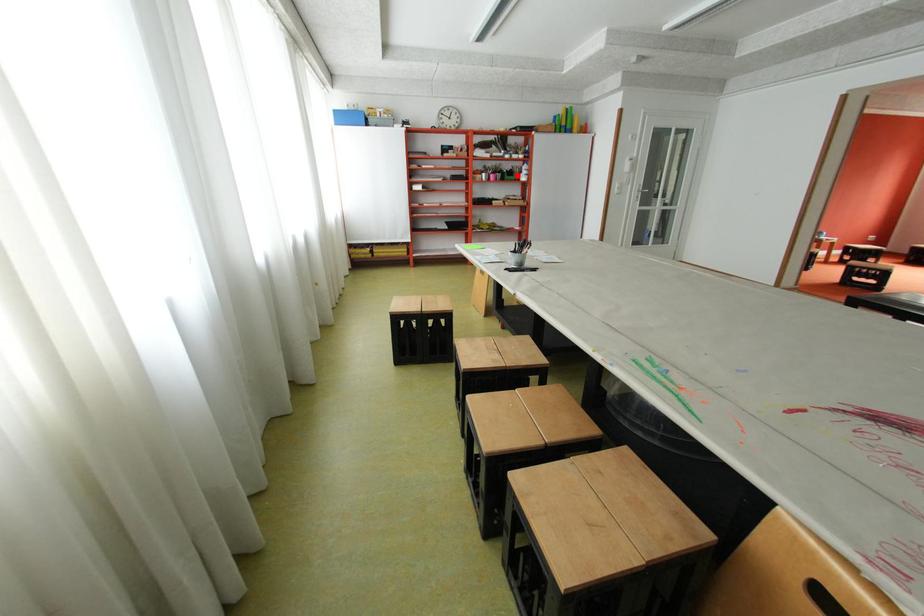
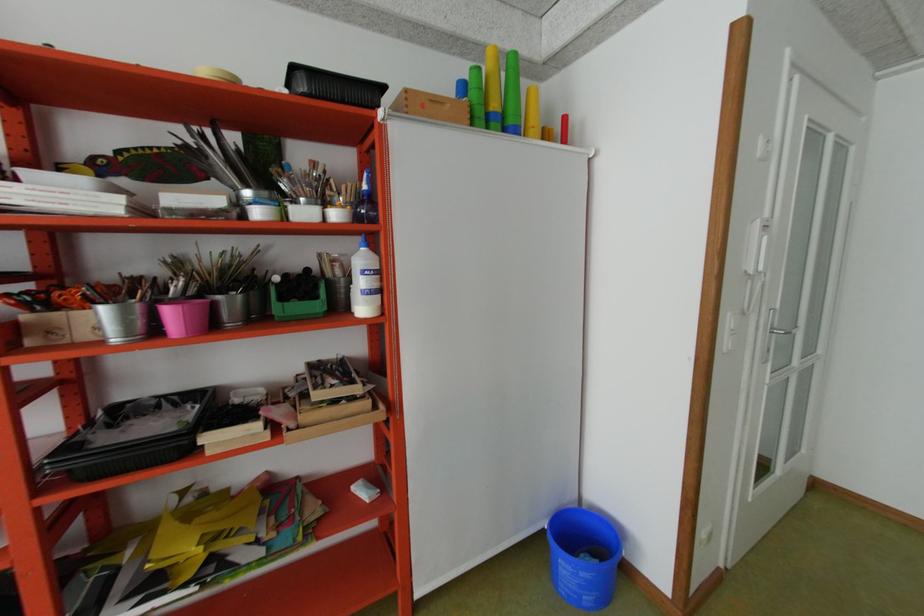
The point at the highlighted location is marked in the first image. Where is the corresponding point in the second image?

(292, 299)